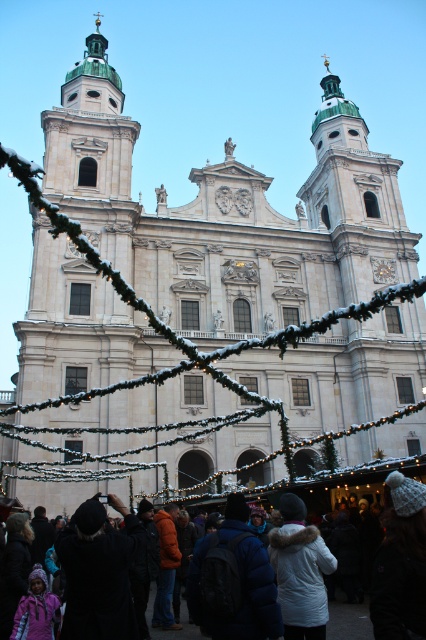
Question: Is dark blue puffy jacket at center further to the viewer compared to black woolen hat at center?

Choices:
 (A) yes
 (B) no

Answer: (B)

Question: Based on their relative distances, which object is nearer to the black woolen hat at center?

Choices:
 (A) dark blue puffy jacket at center
 (B) white fur-trimmed coat at center

Answer: (A)

Question: Can you confirm if black woolen hat at center is positioned below white fur-trimmed coat at center?

Choices:
 (A) yes
 (B) no

Answer: (A)

Question: From the image, what is the correct spatial relationship of dark blue puffy jacket at center in relation to black woolen hat at center?

Choices:
 (A) left
 (B) right

Answer: (B)

Question: Which object is farther from the camera taking this photo?

Choices:
 (A) black woolen hat at center
 (B) white woolen hat at lower center
 (C) dark blue puffy jacket at center
 (D) white fur-trimmed coat at center

Answer: (D)

Question: Which point appears farthest from the camera in this image?

Choices:
 (A) (236, 611)
 (B) (368, 632)
 (C) (97, 611)

Answer: (B)